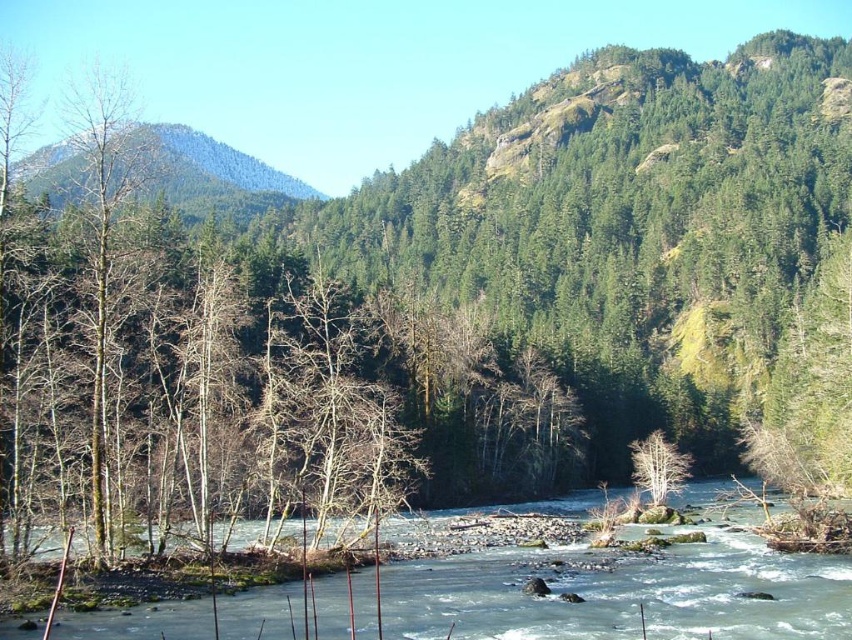
Who is taller, clear water at center or green forested mountain at upper left?

With more height is green forested mountain at upper left.

Is point (751, 600) farther from viewer compared to point (82, 189)?

No, it is in front of (82, 189).

Does point (203, 618) come farther from viewer compared to point (228, 157)?

No, (203, 618) is in front of (228, 157).

I want to click on clear water at center, so click(x=623, y=593).

What do you see at coordinates (206, 173) in the screenshot? The width and height of the screenshot is (852, 640). I see `green forested mountain at upper left` at bounding box center [206, 173].

I want to click on green forested mountain at upper left, so click(x=206, y=173).

Find the location of a particular element. The height and width of the screenshot is (640, 852). green forested mountain at upper left is located at coordinates (206, 173).

The height and width of the screenshot is (640, 852). In order to click on clear water at center in this screenshot , I will do `click(623, 593)`.

Can you confirm if clear water at center is positioned above white matte tree at center?

Correct, clear water at center is located above white matte tree at center.

Is point (743, 513) behind point (639, 448)?

No, (743, 513) is in front of (639, 448).

Image resolution: width=852 pixels, height=640 pixels. In order to click on clear water at center in this screenshot , I will do `click(623, 593)`.